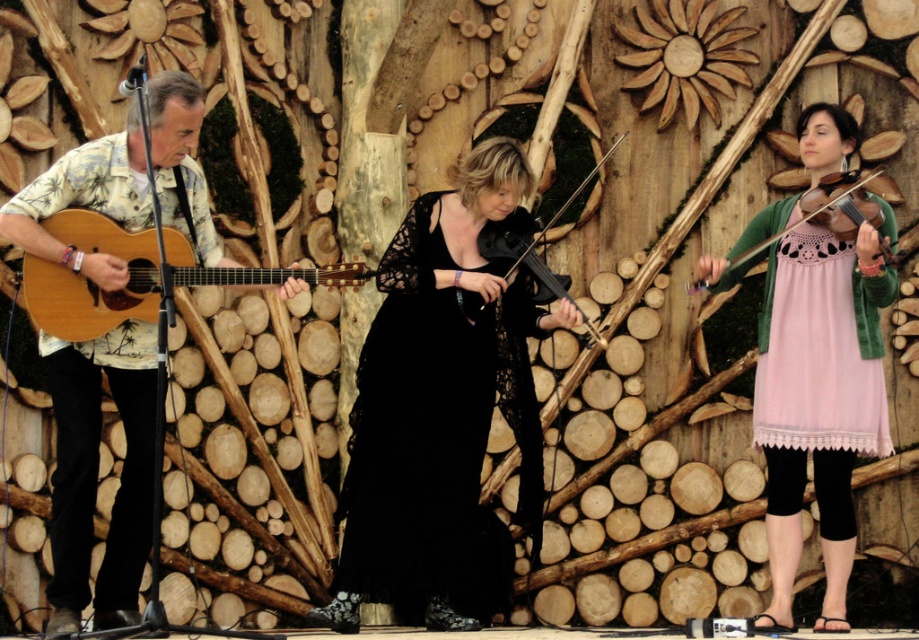
Between pink lace dress at center and matte black violin at right, which one is positioned lower?

pink lace dress at center is below.

Where is `pink lace dress at center`? pink lace dress at center is located at coordinates (819, 397).

Is point (766, 275) positioned behind point (733, 266)?

Yes, it is.

Where is `pink lace dress at center`? The image size is (919, 640). pink lace dress at center is located at coordinates (819, 397).

Who is more forward, (820, 384) or (506, 273)?

Point (820, 384) is more forward.

Does pink lace dress at right have a lesser width compared to black matte violin at center?

Correct, pink lace dress at right's width is less than black matte violin at center's.

Does point (823, 272) come in front of point (600, 340)?

No.

Image resolution: width=919 pixels, height=640 pixels. I want to click on pink lace dress at right, so click(x=817, y=355).

I want to click on black lace dress at center, so click(437, 433).

Between black lace dress at center and black matte violin at center, which one is positioned higher?

black matte violin at center

Is point (432, 465) closer to viewer compared to point (579, 189)?

Yes, it is.

Identify the location of black lace dress at center. 437,433.